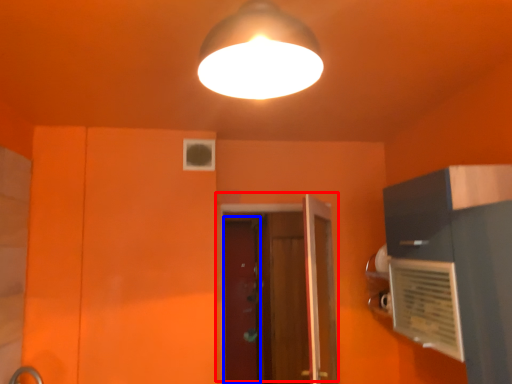
Question: Which object appears closest to the camera in this image, door (highlighted by a red box) or screen door (highlighted by a blue box)?

Choices:
 (A) door
 (B) screen door

Answer: (A)